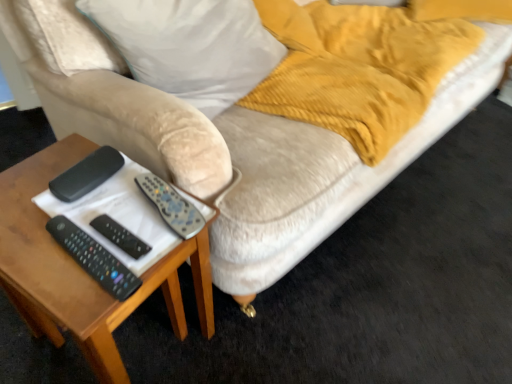
Question: Does black plastic remote control at left have a larger size compared to black plastic remote at center, positioned as the second remote in top-to-bottom order?

Choices:
 (A) yes
 (B) no

Answer: (A)

Question: Considering the relative sizes of black plastic remote control at left and black plastic remote at center, positioned as the second remote in top-to-bottom order, in the image provided, is black plastic remote control at left smaller than black plastic remote at center, positioned as the second remote in top-to-bottom order,?

Choices:
 (A) yes
 (B) no

Answer: (B)

Question: From the image's perspective, is black plastic remote control at left on top of black plastic remote at center, positioned as the second remote in top-to-bottom order?

Choices:
 (A) yes
 (B) no

Answer: (A)

Question: Could black plastic remote at center, arranged as the 2th remote when ordered from the bottom, be considered to be inside black plastic remote control at left?

Choices:
 (A) yes
 (B) no

Answer: (B)

Question: From the image's perspective, is black plastic remote control at left located beneath black plastic remote at center, positioned as the second remote in top-to-bottom order?

Choices:
 (A) yes
 (B) no

Answer: (B)

Question: From a real-world perspective, does black plastic remote control at left sit lower than black plastic remote at center, arranged as the 2th remote when ordered from the bottom?

Choices:
 (A) yes
 (B) no

Answer: (B)

Question: Is black plastic remote control at left located outside silver metallic remote at center, the first remote when ordered from top to bottom?

Choices:
 (A) no
 (B) yes

Answer: (B)

Question: From a real-world perspective, is black plastic remote control at left beneath silver metallic remote at center, the third remote positioned from the bottom?

Choices:
 (A) no
 (B) yes

Answer: (A)

Question: Considering the relative sizes of black plastic remote control at left and silver metallic remote at center, the third remote positioned from the bottom, in the image provided, is black plastic remote control at left taller than silver metallic remote at center, the third remote positioned from the bottom,?

Choices:
 (A) yes
 (B) no

Answer: (A)

Question: From the image's perspective, is black plastic remote control at left beneath silver metallic remote at center, the third remote positioned from the bottom?

Choices:
 (A) no
 (B) yes

Answer: (A)

Question: Is silver metallic remote at center, the third remote positioned from the bottom, surrounded by black plastic remote control at left?

Choices:
 (A) no
 (B) yes

Answer: (A)

Question: Does black plastic remote control at left have a lesser height compared to silver metallic remote at center, the first remote when ordered from top to bottom?

Choices:
 (A) yes
 (B) no

Answer: (B)

Question: From a real-world perspective, is silver metallic remote at center, the first remote when ordered from top to bottom, on black plastic remote control at left?

Choices:
 (A) yes
 (B) no

Answer: (B)